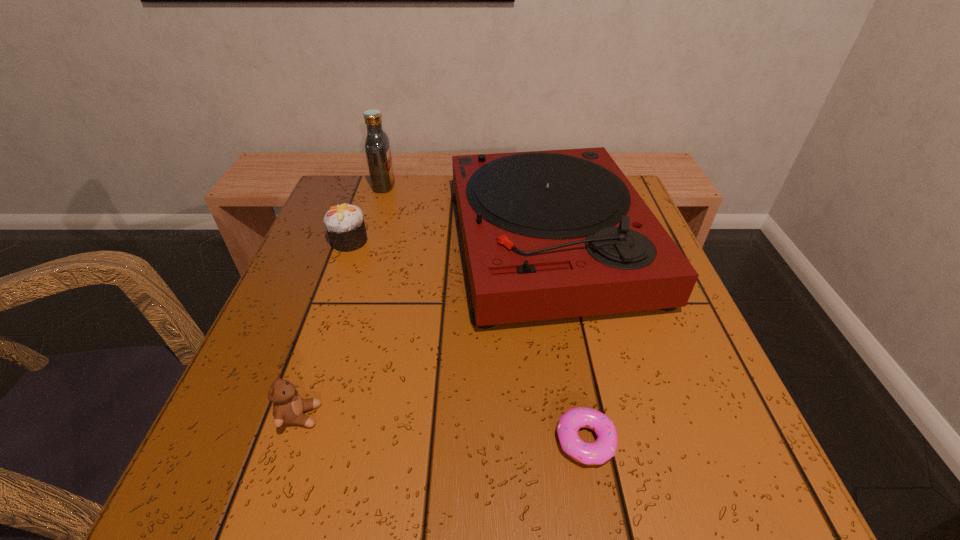
Image resolution: width=960 pixels, height=540 pixels. In order to click on vacant region between the shortest object and the teddy bear in this screenshot , I will do `click(443, 428)`.

You are a GUI agent. You are given a task and a screenshot of the screen. Output one action in this format:
    pyautogui.click(x=<x>, y=<y>)
    Task: Click on the unoccupied area between the cupcake and the second tallest object
    Image resolution: width=960 pixels, height=540 pixels.
    Given the screenshot: What is the action you would take?
    pyautogui.click(x=449, y=242)

This screenshot has width=960, height=540. Find the location of `object that stands as the second closest to the tallest object`. object that stands as the second closest to the tallest object is located at coordinates click(x=552, y=234).

You are a GUI agent. You are given a task and a screenshot of the screen. Output one action in this format:
    pyautogui.click(x=<x>, y=<y>)
    Task: Click on the object identified as the third closest to the vodka
    
    Given the screenshot: What is the action you would take?
    pyautogui.click(x=288, y=407)

Where is `free space that satisfies the following two spatial constraints: 1. on the front-facing side of the record player; 2. on the right side of the tallest object`? Image resolution: width=960 pixels, height=540 pixels. free space that satisfies the following two spatial constraints: 1. on the front-facing side of the record player; 2. on the right side of the tallest object is located at coordinates point(366,243).

Identify the location of vacant space that satisfies the following two spatial constraints: 1. on the front-facing side of the doughnut; 2. on the right side of the teddy bear. (292, 441).

At what (x,y) coordinates should I click in order to perform the action: click on free space that satisfies the following two spatial constraints: 1. on the front side of the shortest object; 2. on the right side of the cupcake. Please return your answer as a coordinate pair (x, y). Looking at the image, I should click on (276, 441).

At what (x,y) coordinates should I click in order to perform the action: click on free spot that satisfies the following two spatial constraints: 1. on the front-facing side of the teddy bear; 2. on the right side of the shortest object. Please return your answer as a coordinate pair (x, y). The image size is (960, 540). Looking at the image, I should click on point(292,441).

Identify the location of vacant position in the image that satisfies the following two spatial constraints: 1. on the front side of the cupcake; 2. on the left side of the doughnut. (276, 441).